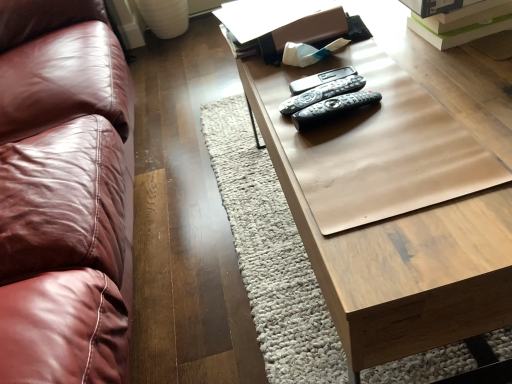
I want to click on free space on the front side of black plastic remotes at center, arranged as the 2th remote when viewed from the back, so (x=361, y=157).